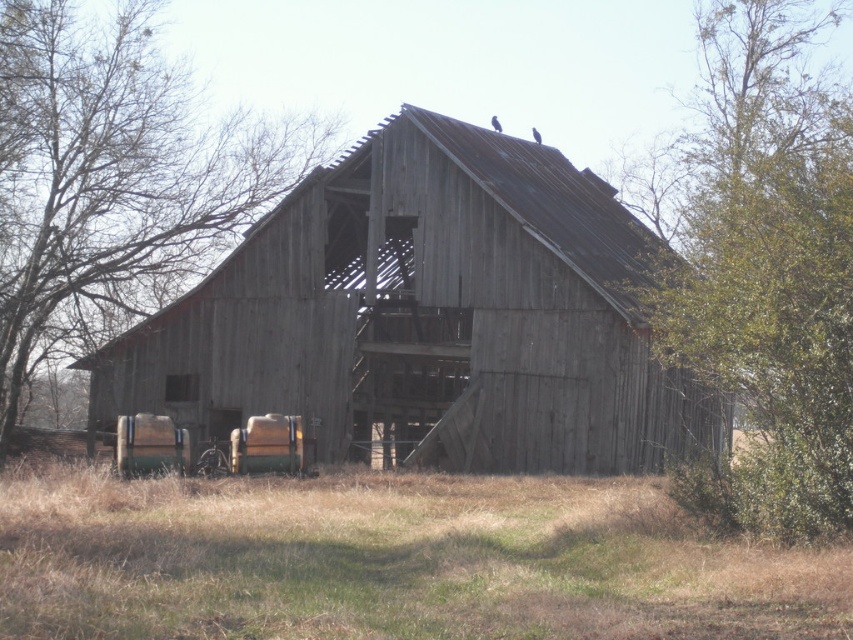
You are standing at point A with coordinates point A at (207,397) and want to walk to point B at 0.377, 0.755. The path between them is straight. The barn is in your way. Can you walk around the barn to reach point B without going through the barn?

The points are 34.59 meters apart. Since the barn is in the way, you can walk around it to reach point B without going through the barn.

You are standing in the field with dry grass and want to take a photo of the weathered wood barn at center and the brown wood tree at left. Which object should you focus on first if you want both to be in clear focus?

You should focus on the weathered wood barn at center first because it is closer to you than the brown wood tree at left. By focusing on the closer object, the tree will also be in focus due to the depth of field.